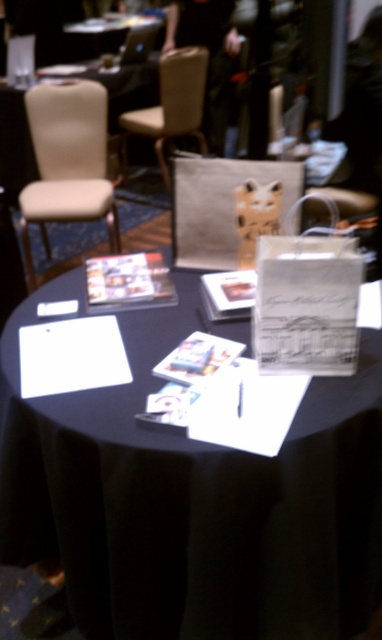
Is point (29, 176) positioned behind point (153, 106)?

No, (29, 176) is in front of (153, 106).

Which of these two, white fabric table at upper left or beige fabric chair at upper center, stands taller?

beige fabric chair at upper center

The image size is (382, 640). Identify the location of white fabric table at upper left. (14, 145).

This screenshot has height=640, width=382. Identify the location of white fabric table at upper left. [14, 145].

Who is higher up, black paper at center or beige fabric chair at left?

beige fabric chair at left is higher up.

Between black paper at center and beige fabric chair at left, which one appears on the right side from the viewer's perspective?

black paper at center

Does point (370, 410) lie in front of point (71, 173)?

Yes, it is.

Find the location of a particular element. black paper at center is located at coordinates (191, 497).

Can you confirm if white paper bag at center is positioned below white fabric table at upper left?

Yes, white paper bag at center is below white fabric table at upper left.

This screenshot has width=382, height=640. Describe the element at coordinates (307, 300) in the screenshot. I see `white paper bag at center` at that location.

This screenshot has width=382, height=640. I want to click on white paper bag at center, so click(x=307, y=300).